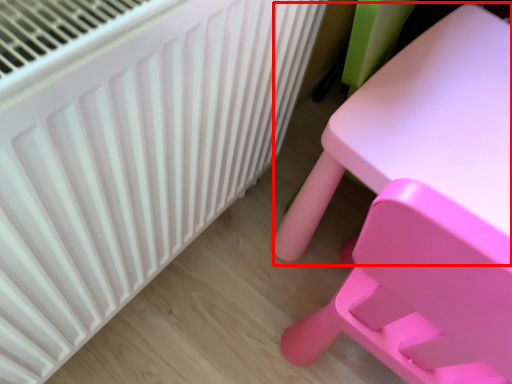
Question: From the image's perspective, where is table (annotated by the red box) located relative to radiator?

Choices:
 (A) above
 (B) below

Answer: (A)